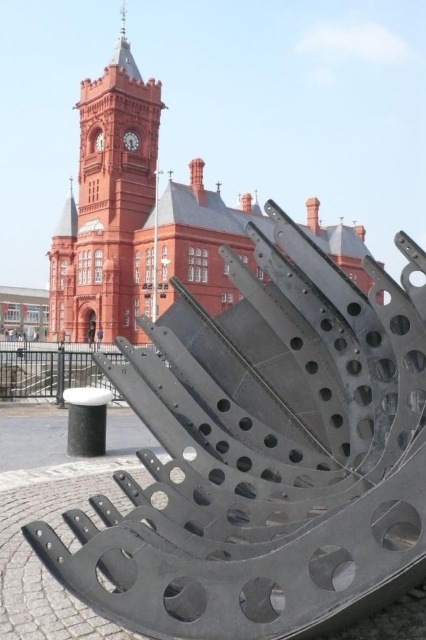
Can you confirm if black metallic sculpture at center is positioned to the right of matte red clock tower at upper left?

Yes, black metallic sculpture at center is to the right of matte red clock tower at upper left.

Is black metallic sculpture at center positioned behind matte red clock tower at upper left?

That is False.

Does point (154, 337) come in front of point (131, 132)?

Yes, point (154, 337) is closer to viewer.

Locate an element on the screen. black metallic sculpture at center is located at coordinates (267, 456).